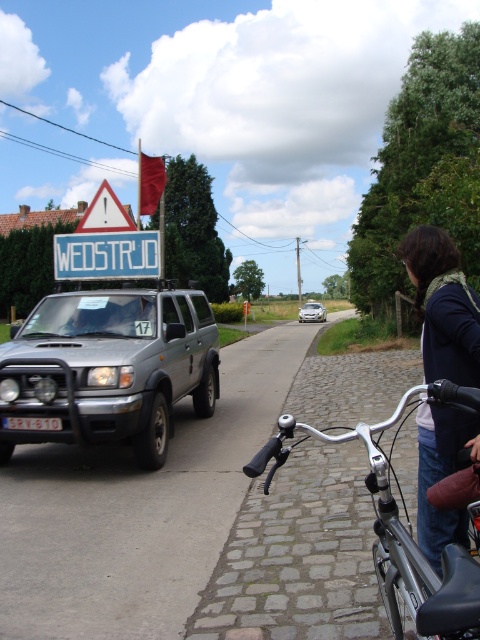
You are a delivery driver navigating a rural road and see the blue plastic sign at upper center and the white triangular warning sign at upper left. Which sign is narrower?

The blue plastic sign at upper center is thinner than the white triangular warning sign at upper left, so it is narrower.

You are a pedestrian crossing the road and see the blue plastic sign at upper center and the white triangular warning sign at upper left. The distance between them is crucial for determining safe crossing. Can you safely cross between these two signs if the safe crossing distance is 5 meters?

The blue plastic sign at upper center and the white triangular warning sign at upper left are 6.49 meters apart. Since the safe crossing distance is 5 meters, the distance between them is greater than the required safe distance, so it is not safe to cross between them.

You are a drone operator trying to capture aerial footage of the rural road scene. You notice two points marked in the image. The first point is at coordinates point (75, 307) and the second point is at point (432, 374). Which point is closer to your drone camera lens?

Point (75, 307) is further to the camera than point (432, 374), so the second point is closer to the drone camera lens.